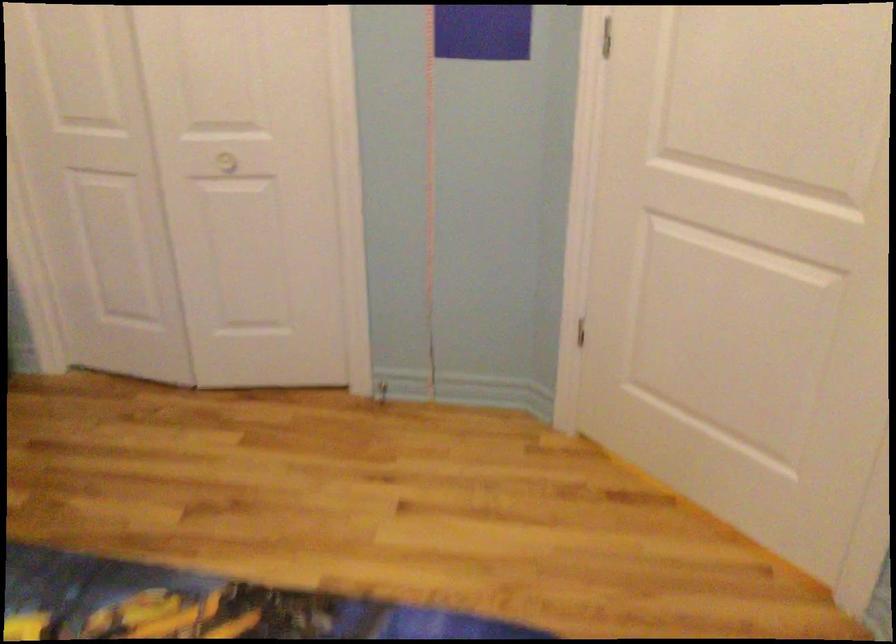
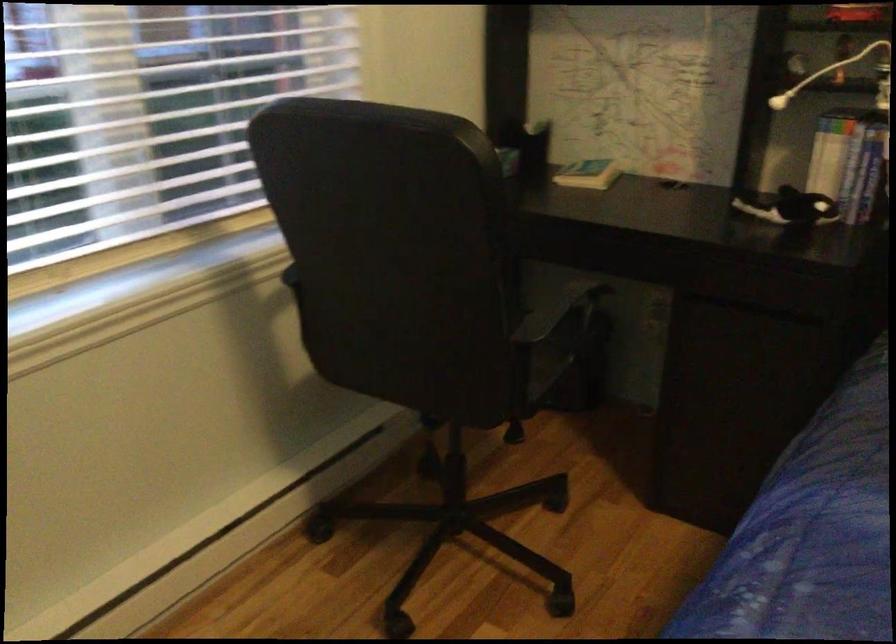
How did the camera likely rotate?

The camera rotated toward left-down.